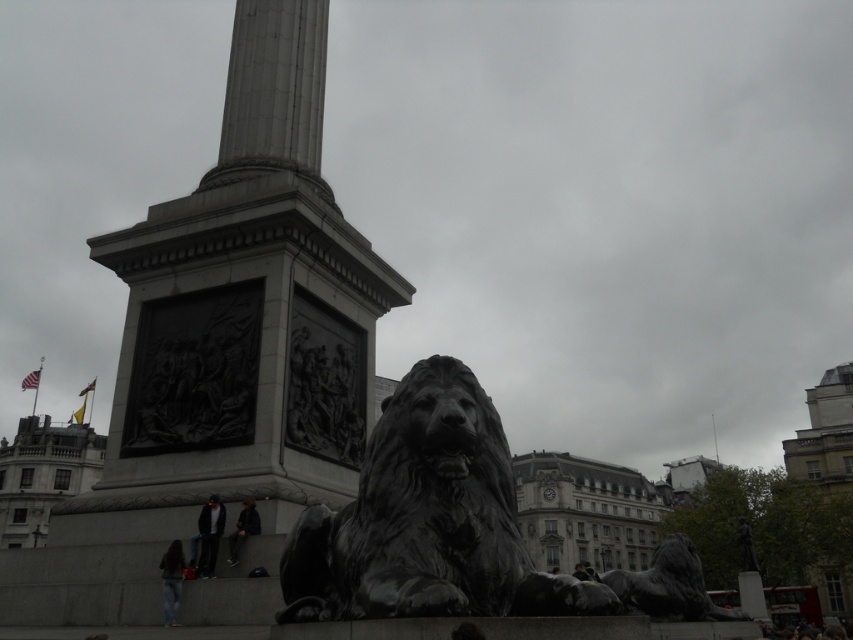
You are a photographer standing at the entrance of the monument. You want to take a photo that includes both the black polished stone lion at center and the dark gray suit at lower left. Which object should you position closer to the camera to ensure both are in focus?

The black polished stone lion at center is larger in size compared to the dark gray suit at lower left. To ensure both are in focus, you should position the black polished stone lion at center closer to the camera since its larger size requires it to be nearer for proper framing while keeping the dark gray suit at lower left in the background.

You are standing in front of the monument and see the dark gray jeans at lower left and the dark gray jacket at lower center. Which one is positioned more to the left side of the scene?

The dark gray jeans at lower left is positioned more to the left side of the scene than the dark gray jacket at lower center.